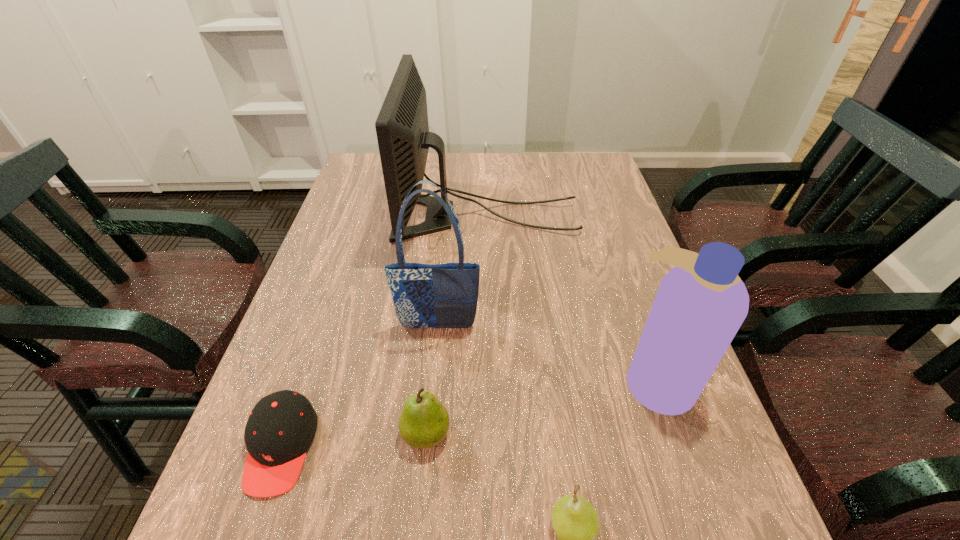
The height and width of the screenshot is (540, 960). What are the coordinates of `vacant space at the far left corner` in the screenshot? It's located at (x=375, y=161).

You are a GUI agent. You are given a task and a screenshot of the screen. Output one action in this format:
    pyautogui.click(x=<x>, y=<y>)
    Task: Click on the free spot between the farther pear and the shampoo
    
    Given the screenshot: What is the action you would take?
    pyautogui.click(x=541, y=407)

Image resolution: width=960 pixels, height=540 pixels. Find the location of `free point between the computer monitor and the shampoo`. free point between the computer monitor and the shampoo is located at coordinates (571, 299).

Where is `empty space between the shortest object and the shampoo`? empty space between the shortest object and the shampoo is located at coordinates (468, 414).

Find the location of `vacant space in between the shopping bag and the farther pear`. vacant space in between the shopping bag and the farther pear is located at coordinates (432, 381).

Find the location of a particular element. vacant space in between the second farthest object and the left pear is located at coordinates (432, 381).

Select which object appears as the closest to the computer monitor. Please provide its 2D coordinates. Your answer should be formatted as a tuple, i.e. [(x, y)], where the tuple contains the x and y coordinates of a point satisfying the conditions above.

[(445, 295)]

Identify which object is located as the fifth nearest to the farther pear. Please provide its 2D coordinates. Your answer should be formatted as a tuple, i.e. [(x, y)], where the tuple contains the x and y coordinates of a point satisfying the conditions above.

[(402, 128)]

Locate an element on the screen. Image resolution: width=960 pixels, height=540 pixels. free space in the image that satisfies the following two spatial constraints: 1. on the screen side of the computer monitor; 2. on the front-facing side of the leftmost object is located at coordinates (491, 448).

The height and width of the screenshot is (540, 960). What are the coordinates of `free space that satisfies the following two spatial constraints: 1. on the screen side of the computer monitor; 2. on the front-facing side of the leftmost object` in the screenshot? It's located at point(491,448).